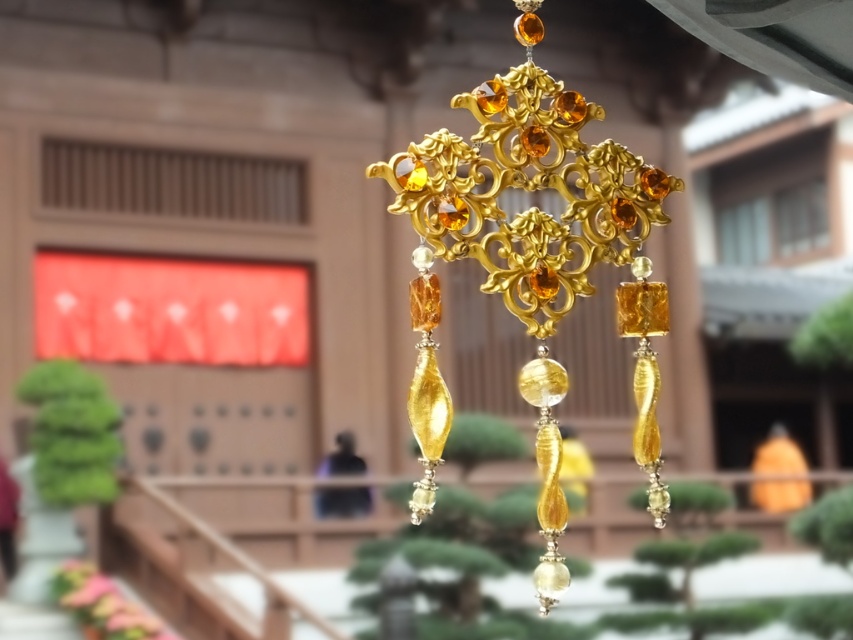
Describe the element at coordinates (534, 257) in the screenshot. I see `gold metallic cross at center` at that location.

Can you confirm if gold metallic cross at center is positioned below matte pink flower at lower left?

No.

The image size is (853, 640). I want to click on gold metallic cross at center, so click(534, 257).